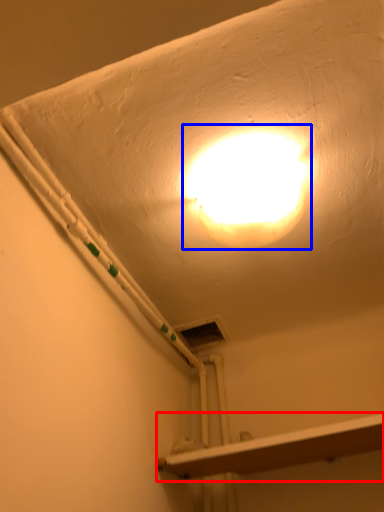
Question: Among these objects, which one is farthest to the camera, shelf (highlighted by a red box) or lamp (highlighted by a blue box)?

Choices:
 (A) shelf
 (B) lamp

Answer: (A)